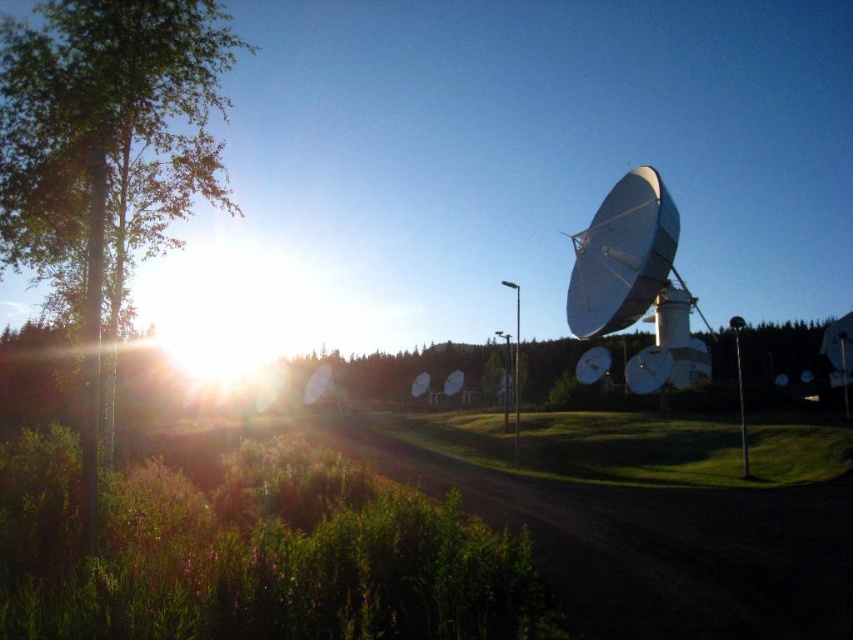
Does green grass at center have a larger size compared to white glossy satellite dish at right?

No.

Does point (761, 445) come farther from viewer compared to point (647, 193)?

No, (761, 445) is in front of (647, 193).

Where is `green grass at center`? green grass at center is located at coordinates (677, 449).

You are a GUI agent. You are given a task and a screenshot of the screen. Output one action in this format:
    pyautogui.click(x=<x>, y=<y>)
    Task: Click on the green leafy tree at left
    The width and height of the screenshot is (853, 640).
    Given the screenshot: What is the action you would take?
    pyautogui.click(x=93, y=134)

Can you confirm if green leafy tree at left is smaller than white glossy satellite dish at right?

Actually, green leafy tree at left might be larger than white glossy satellite dish at right.

Does point (19, 113) lie behind point (579, 234)?

No, (19, 113) is in front of (579, 234).

At what (x,y) coordinates should I click in order to perform the action: click on green leafy tree at left. Please return your answer as a coordinate pair (x, y). The height and width of the screenshot is (640, 853). Looking at the image, I should click on (93, 134).

Based on the photo, which is above, green leafy tree at left or green grass at center?

green leafy tree at left is above.

Is point (90, 413) positioned after point (628, 413)?

That is False.

Describe the element at coordinates (93, 134) in the screenshot. I see `green leafy tree at left` at that location.

Find the location of a particular element. The image size is (853, 640). green leafy tree at left is located at coordinates (93, 134).